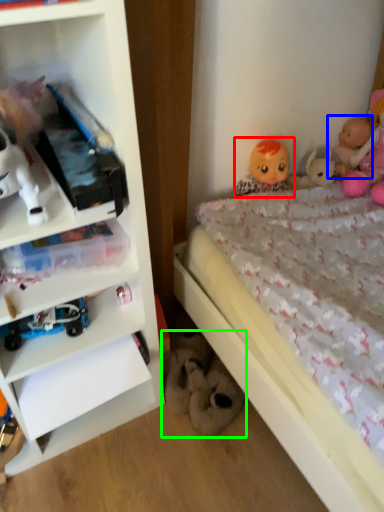
Question: Estimate the real-world distances between objects in this image. Which object is farther from doll (highlighted by a red box), doll (highlighted by a blue box) or toy (highlighted by a green box)?

Choices:
 (A) doll
 (B) toy

Answer: (B)